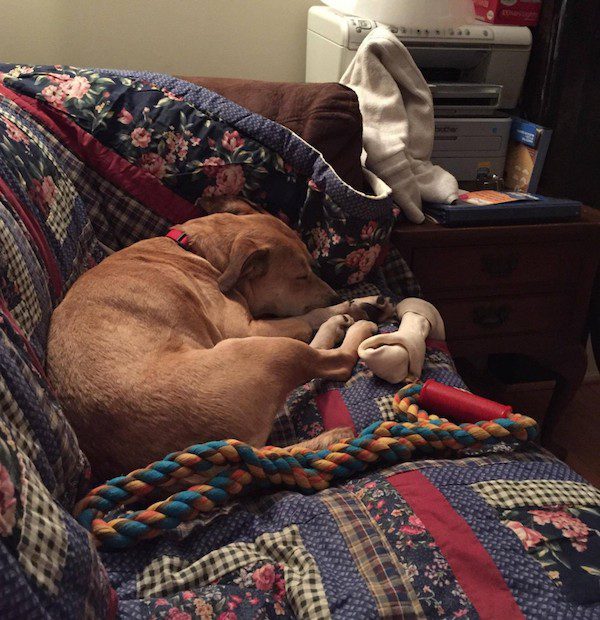
The image size is (600, 620). In order to click on wall in this screenshot , I will do `click(175, 36)`.